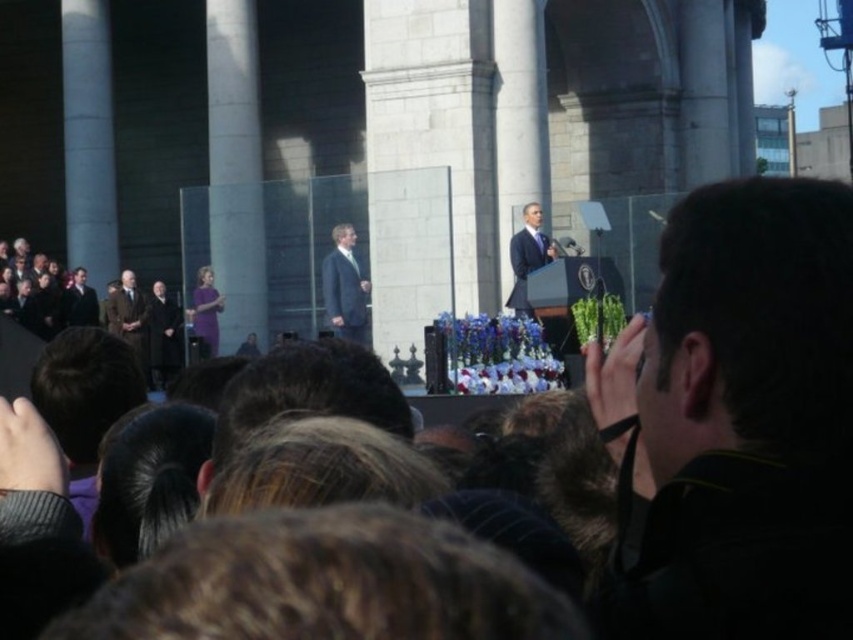
Question: Can you confirm if black fabric camera at right is positioned above dark suit at center?

Choices:
 (A) yes
 (B) no

Answer: (B)

Question: Which point appears closest to the camera in this image?

Choices:
 (A) (535, 224)
 (B) (128, 289)
 (C) (784, 534)
 (D) (177, 323)

Answer: (C)

Question: Does dark gray suit at left have a smaller size compared to dark brown suit at left?

Choices:
 (A) yes
 (B) no

Answer: (B)

Question: Is brown suit at left wider than purple fabric dress at center?

Choices:
 (A) yes
 (B) no

Answer: (A)

Question: Estimate the real-world distances between objects in this image. Which object is closer to the purple fabric dress at center?

Choices:
 (A) matte gray suit at center
 (B) dark suit at center

Answer: (A)

Question: Which point is closer to the camera taking this photo?

Choices:
 (A) (132, 282)
 (B) (212, 289)
 (C) (361, 300)

Answer: (C)